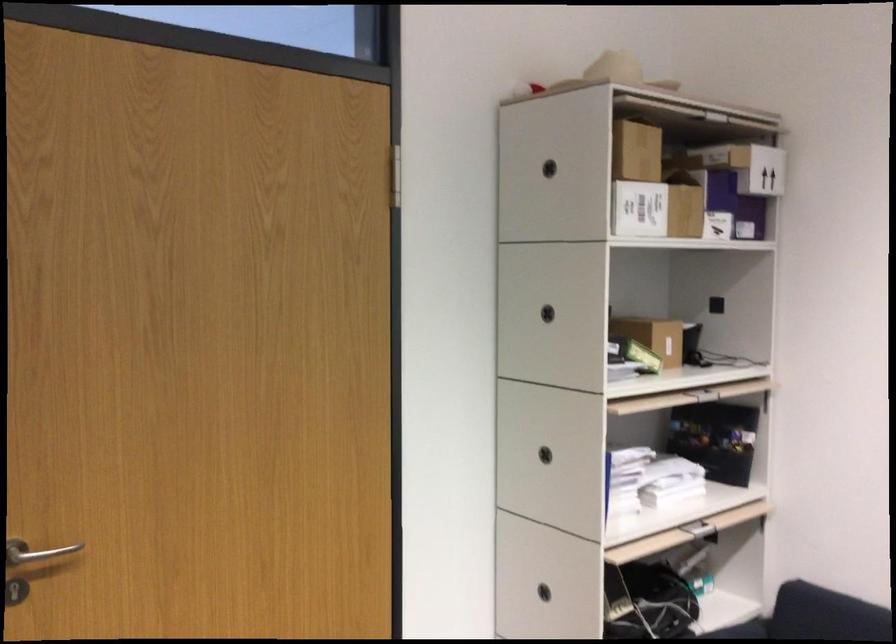
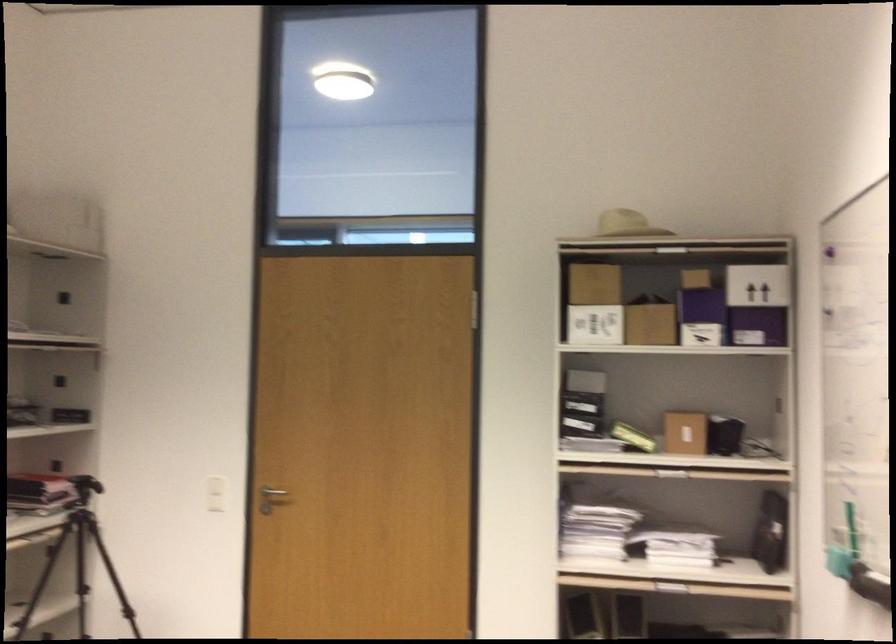
In the second image, find the point that corresponds to point (616, 154) in the first image.

(592, 283)